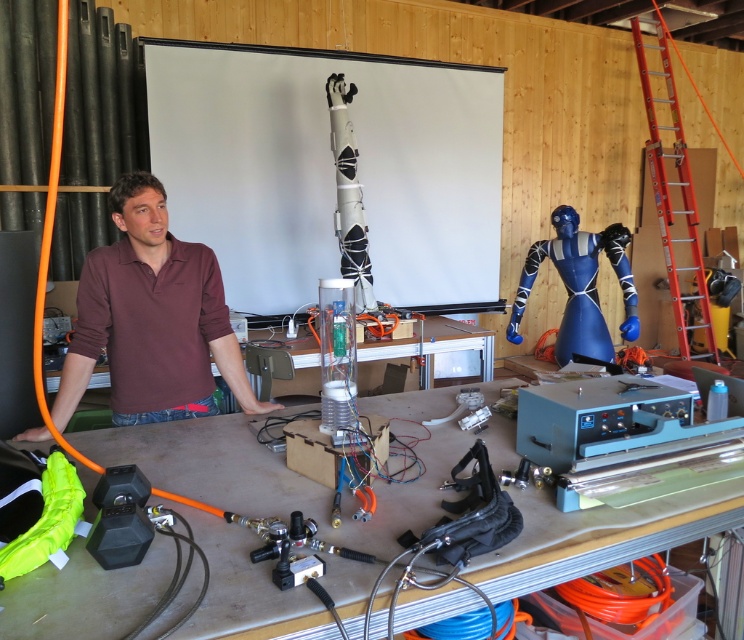
Who is positioned more to the right, white matte projection screen at upper center or metallic gray table at center?

From the viewer's perspective, metallic gray table at center appears more on the right side.

Who is more forward, (217, 204) or (202, 426)?

Positioned in front is point (202, 426).

Where is `white matte projection screen at upper center`? Image resolution: width=744 pixels, height=640 pixels. white matte projection screen at upper center is located at coordinates (327, 168).

What do you see at coordinates (275, 476) in the screenshot? The height and width of the screenshot is (640, 744). I see `metallic gray table at center` at bounding box center [275, 476].

Does metallic gray table at center have a greater width compared to maroon cotton polo shirt at center?

Yes.

Does point (718, 502) come closer to viewer compared to point (93, 314)?

Yes, it is in front of point (93, 314).

Where is `metallic gray table at center`? The image size is (744, 640). metallic gray table at center is located at coordinates (275, 476).

Is red metal ladder at right shorter than matte plastic table at center?

No, red metal ladder at right is not shorter than matte plastic table at center.

Does point (679, 198) come farther from viewer compared to point (51, 384)?

Yes, point (679, 198) is farther from viewer.

The image size is (744, 640). In order to click on red metal ladder at right in this screenshot , I will do `click(676, 204)`.